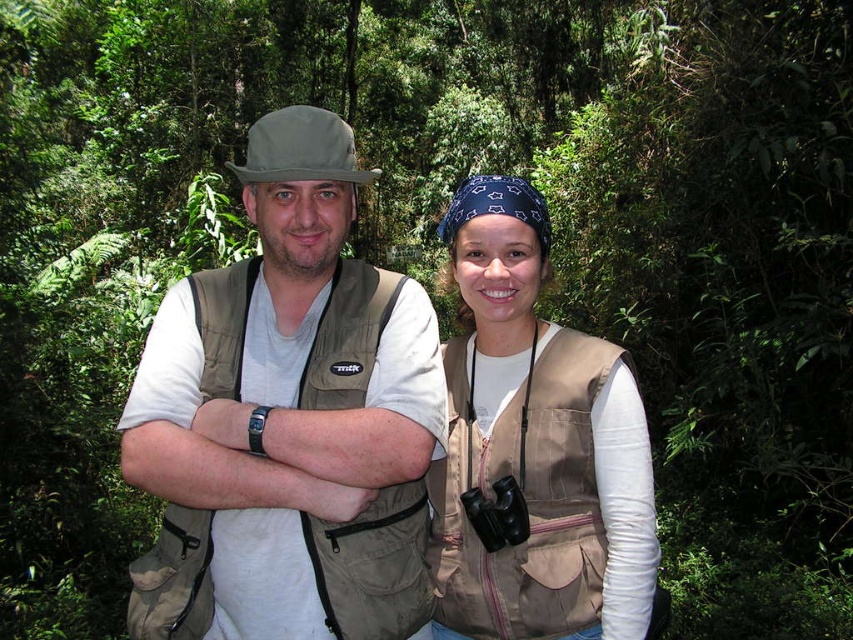
Question: Does khaki fabric hat at center lie behind tan canvas vest at center?

Choices:
 (A) no
 (B) yes

Answer: (A)

Question: Which point is closer to the camera taking this photo?

Choices:
 (A) (167, 490)
 (B) (509, 464)

Answer: (A)

Question: Observing the image, what is the correct spatial positioning of khaki fabric hat at center in reference to tan canvas vest at center?

Choices:
 (A) left
 (B) right

Answer: (A)

Question: Which point is farther to the camera?

Choices:
 (A) (517, 364)
 (B) (254, 588)

Answer: (A)

Question: Is khaki fabric hat at center smaller than tan canvas vest at center?

Choices:
 (A) yes
 (B) no

Answer: (B)

Question: Which point appears closest to the camera in this image?

Choices:
 (A) coord(447,477)
 (B) coord(274,568)

Answer: (B)